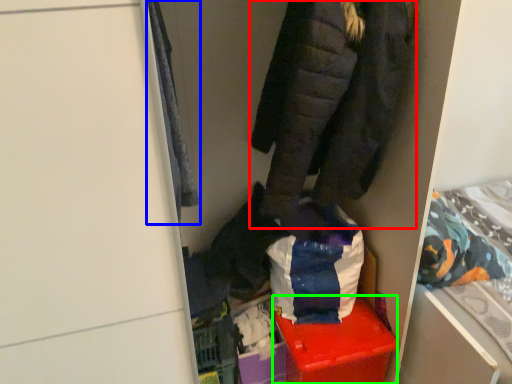
Question: Which object is positioned farthest from jacket (highlighted by a red box)? Select from cloak (highlighted by a blue box) and storage box (highlighted by a green box).

Choices:
 (A) cloak
 (B) storage box

Answer: (B)